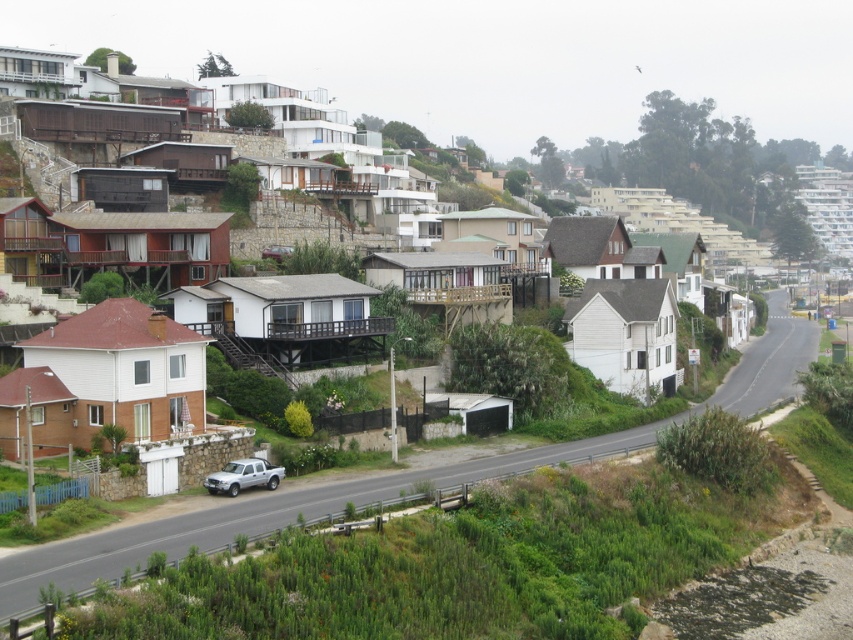
Is point (247, 477) farther from viewer compared to point (260, 256)?

That is False.

Between silver metallic pickup truck at center and metallic maroon car at center, which one has more height?

Standing taller between the two is metallic maroon car at center.

Is point (236, 477) positioned behind point (273, 250)?

That is False.

Where is `silver metallic pickup truck at center`? Image resolution: width=853 pixels, height=640 pixels. silver metallic pickup truck at center is located at coordinates (242, 476).

Can you confirm if white matte house at center is positioned to the left of silver metallic pickup truck at center?

In fact, white matte house at center is to the right of silver metallic pickup truck at center.

Does white matte house at center appear under silver metallic pickup truck at center?

No.

This screenshot has width=853, height=640. Find the location of `white matte house at center`. white matte house at center is located at coordinates (119, 120).

Can you confirm if white matte house at center is positioned to the left of metallic maroon car at center?

Incorrect, white matte house at center is not on the left side of metallic maroon car at center.

Can you confirm if white matte house at center is taller than metallic maroon car at center?

Yes.

Is point (376, 248) farther from viewer compared to point (276, 252)?

Yes, it is.

This screenshot has width=853, height=640. Find the location of `white matte house at center`. white matte house at center is located at coordinates (119, 120).